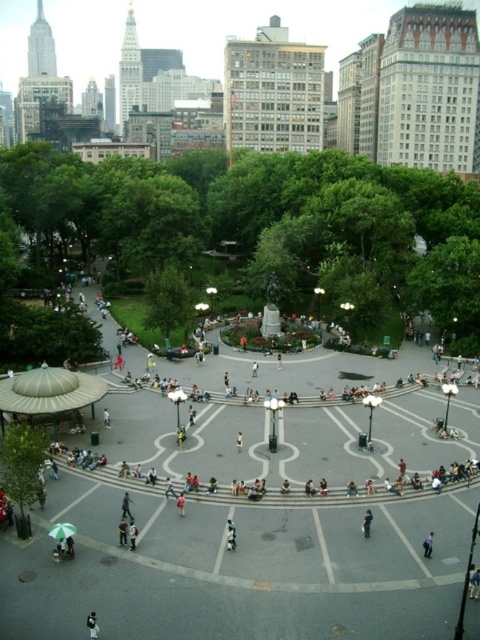
Which is more to the right, dark gray fabric jacket at center or red fabric jacket at center?

Positioned to the right is red fabric jacket at center.

Can you confirm if dark gray fabric jacket at center is wider than red fabric jacket at center?

Indeed, dark gray fabric jacket at center has a greater width compared to red fabric jacket at center.

Is point (90, 628) closer to viewer compared to point (181, 515)?

Yes, point (90, 628) is in front of point (181, 515).

This screenshot has width=480, height=640. In order to click on dark gray fabric jacket at center in this screenshot , I will do `click(92, 625)`.

From the picture: Can you confirm if light brown leather jacket at center is wider than dark blue fabric at center?

No, light brown leather jacket at center is not wider than dark blue fabric at center.

Who is positioned more to the right, light brown leather jacket at center or dark blue fabric at center?

Positioned to the right is dark blue fabric at center.

Does point (129, 516) come closer to viewer compared to point (364, 532)?

No, it is behind (364, 532).

What are the coordinates of `light brown leather jacket at center` in the screenshot? It's located at (127, 506).

Does light brown leather jacket at center appear under red fabric jacket at center?

Incorrect, light brown leather jacket at center is not positioned below red fabric jacket at center.

Identify the location of light brown leather jacket at center. The image size is (480, 640). (127, 506).

What do you see at coordinates (127, 506) in the screenshot?
I see `light brown leather jacket at center` at bounding box center [127, 506].

You are a GUI agent. You are given a task and a screenshot of the screen. Output one action in this format:
    pyautogui.click(x=<x>, y=<y>)
    Task: Click on the light brown leather jacket at center
    
    Given the screenshot: What is the action you would take?
    pyautogui.click(x=127, y=506)